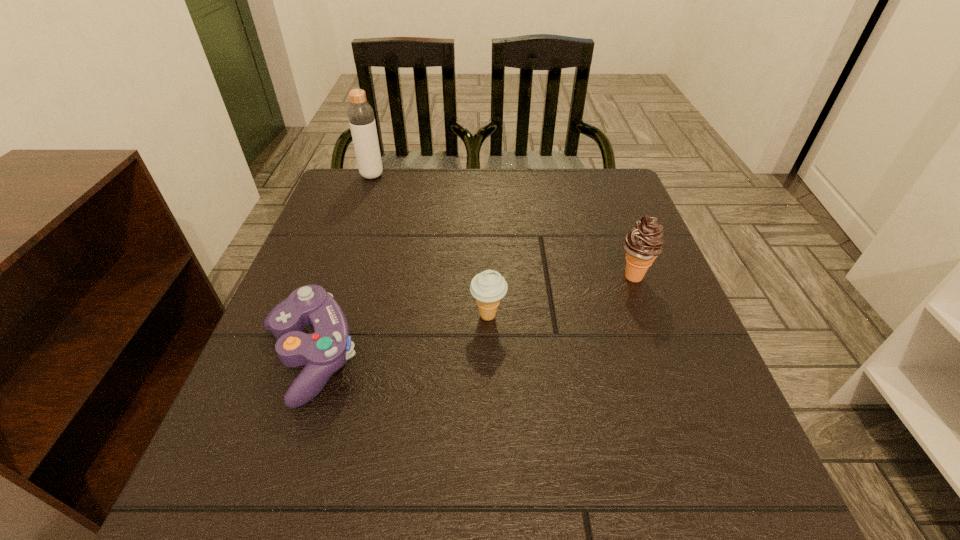
At what (x,y) coordinates should I click in order to perform the action: click on vacant space at the far right corner of the desktop. Please return your answer as a coordinate pair (x, y). Image resolution: width=960 pixels, height=540 pixels. Looking at the image, I should click on (597, 212).

Locate an element on the screen. free spot between the shortest object and the second tallest object is located at coordinates (471, 316).

You are a GUI agent. You are given a task and a screenshot of the screen. Output one action in this format:
    pyautogui.click(x=<x>, y=<y>)
    Task: Click on the vacant area that lies between the farthest object and the second shortest object
    This screenshot has width=960, height=540.
    Given the screenshot: What is the action you would take?
    [x=430, y=246]

I want to click on free space between the left icecream and the farthest object, so click(430, 246).

Locate an element on the screen. This screenshot has width=960, height=540. vacant point located between the shortest object and the farther icecream is located at coordinates (471, 316).

Image resolution: width=960 pixels, height=540 pixels. In order to click on vacant space that's between the nearer icecream and the right icecream in this screenshot , I will do (561, 296).

This screenshot has height=540, width=960. I want to click on free space between the control and the left icecream, so click(398, 336).

The width and height of the screenshot is (960, 540). What are the coordinates of `free spot between the left icecream and the second farthest object` in the screenshot? It's located at (561, 296).

Find the location of `free space between the control and the third object from left to right`. free space between the control and the third object from left to right is located at coordinates (398, 336).

The width and height of the screenshot is (960, 540). What are the coordinates of `free space between the left icecream and the shortest object` in the screenshot? It's located at (398, 336).